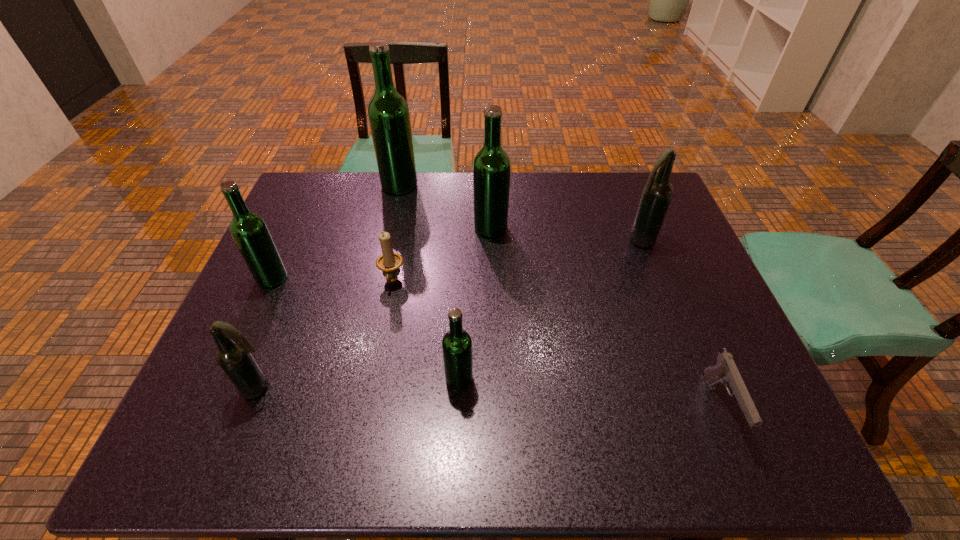
Locate an element on the screen. the tallest beer bottle is located at coordinates (388, 112).

Where is `the farthest green beer bottle`? This screenshot has height=540, width=960. the farthest green beer bottle is located at coordinates (388, 112).

Locate an element on the screen. This screenshot has height=540, width=960. the second tallest beer bottle is located at coordinates (491, 167).

The image size is (960, 540). I want to click on the second farthest green beer bottle, so click(x=491, y=167).

This screenshot has width=960, height=540. I want to click on the farther dark beer bottle, so click(x=657, y=193).

Locate an element on the screen. The image size is (960, 540). the right dark beer bottle is located at coordinates (657, 193).

Image resolution: width=960 pixels, height=540 pixels. What are the coordinates of `the third nearest beer bottle` in the screenshot? It's located at (249, 230).

Locate an element on the screen. The image size is (960, 540). the third biggest green beer bottle is located at coordinates (249, 230).

This screenshot has width=960, height=540. I want to click on the second beer bottle from left to right, so click(x=233, y=355).

Where is `the smaller dark beer bottle`? This screenshot has height=540, width=960. the smaller dark beer bottle is located at coordinates (233, 355).